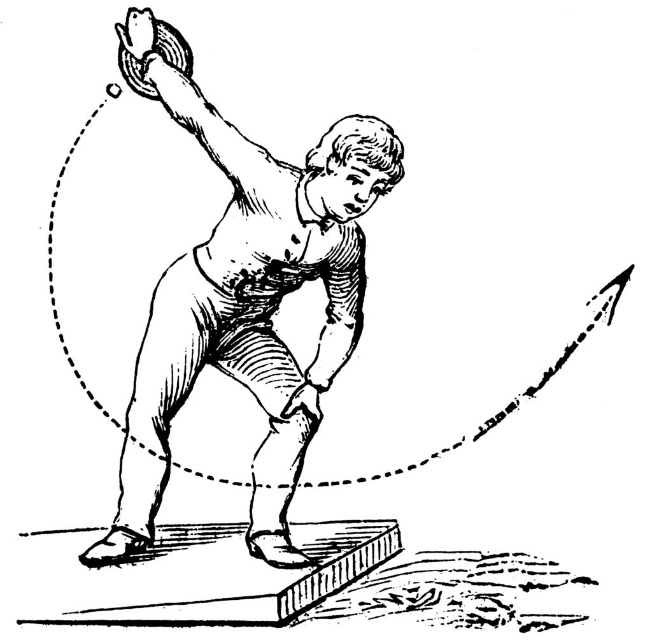
Can you confirm if black line at upper center is smaller than smooth paper man at center?

Correct, black line at upper center occupies less space than smooth paper man at center.

How much distance is there between black line at upper center and smooth paper man at center?

black line at upper center and smooth paper man at center are 1.40 meters apart.

Image resolution: width=652 pixels, height=640 pixels. I want to click on black line at upper center, so click(x=447, y=346).